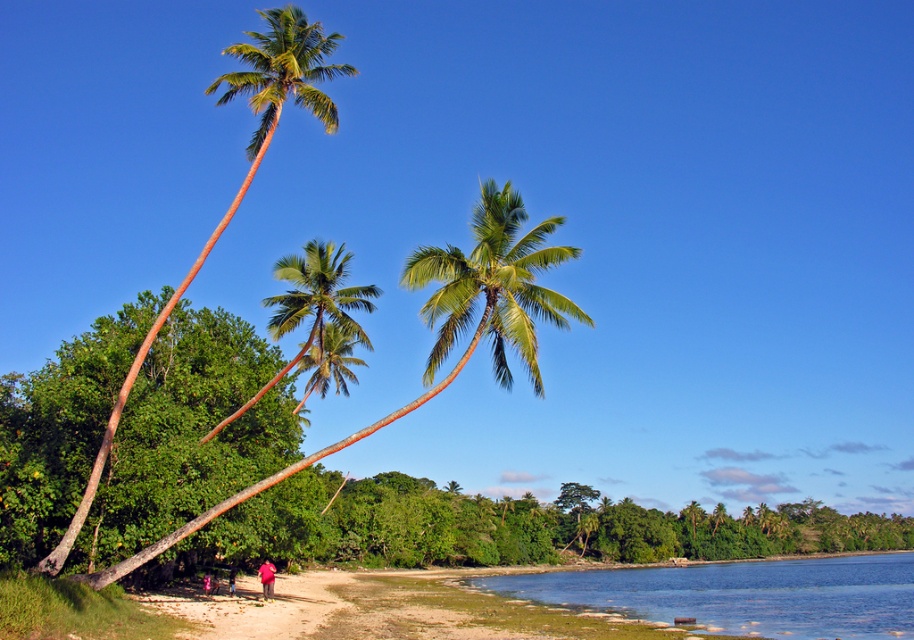
You are standing on the beach and notice the green leafy palm tree at left and the red cotton shirt at lower center. Which object appears bigger in the scene?

The green leafy palm tree at left appears bigger than the red cotton shirt at lower center because it has a larger size compared to the shirt.